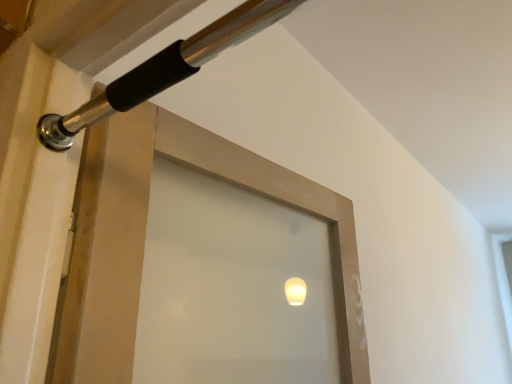
The width and height of the screenshot is (512, 384). What do you see at coordinates (164, 69) in the screenshot?
I see `black rubberized bar at upper center` at bounding box center [164, 69].

Find the location of a particular element. The image size is (512, 384). black rubberized bar at upper center is located at coordinates (164, 69).

At what (x,y) coordinates should I click in order to perform the action: click on black rubberized bar at upper center. Please return your answer as a coordinate pair (x, y). Looking at the image, I should click on (164, 69).